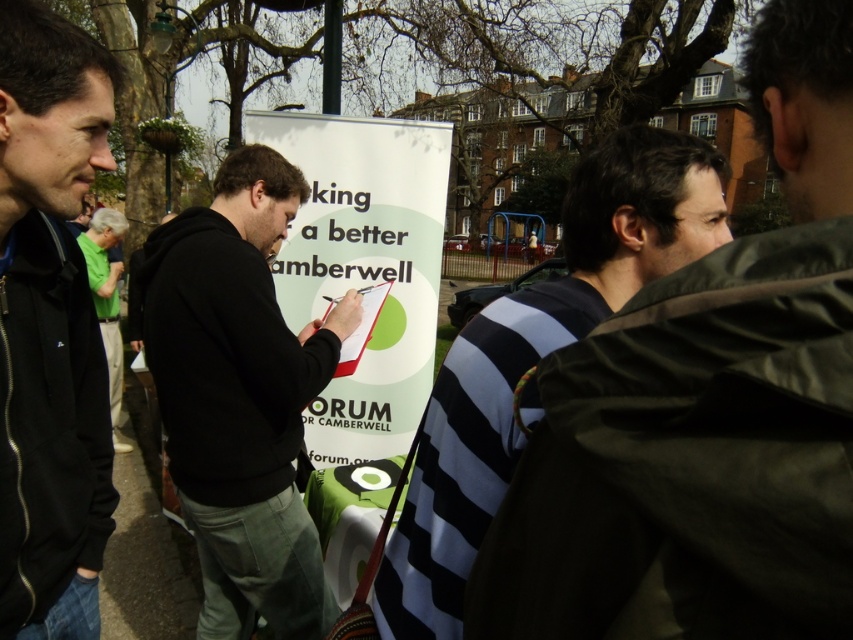
Question: Among these objects, which one is nearest to the camera?

Choices:
 (A) black hoodie at center
 (B) dark blue jacket at left
 (C) striped fabric shirt at center

Answer: (C)

Question: Which point is farther to the camera?

Choices:
 (A) (30, 547)
 (B) (268, 358)
 (C) (109, 212)

Answer: (C)

Question: Is dark blue jacket at left positioned in front of green fabric shirt at left?

Choices:
 (A) no
 (B) yes

Answer: (B)

Question: Observing the image, what is the correct spatial positioning of striped fabric shirt at center in reference to white paper signboard at center?

Choices:
 (A) below
 (B) above

Answer: (A)

Question: Among these objects, which one is nearest to the camera?

Choices:
 (A) striped fabric shirt at center
 (B) white paper signboard at center

Answer: (A)

Question: Is striped fabric shirt at center positioned at the back of black hoodie at center?

Choices:
 (A) yes
 (B) no

Answer: (B)